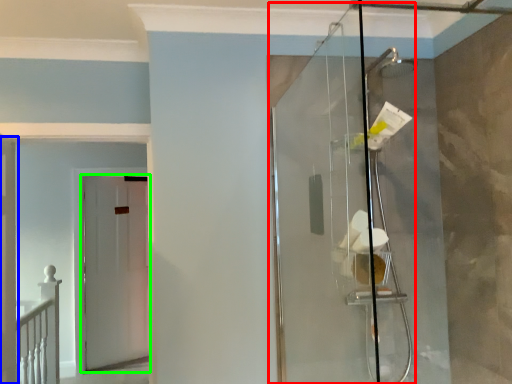
Question: Based on their relative distances, which object is farther from glass door (highlighted by a red box)? Choose from door (highlighted by a blue box) and door (highlighted by a green box).

Choices:
 (A) door
 (B) door

Answer: (B)